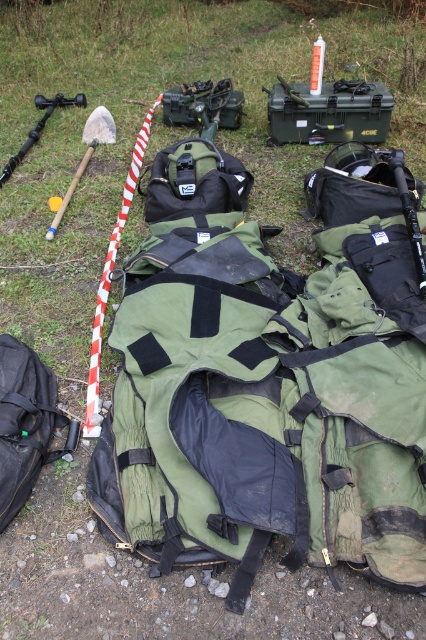
Which is in front, point (55, 28) or point (181, 180)?

Point (181, 180) is in front.

Does green matte backpack at center have a lesser height compared to matte black backpack at center?

Yes, green matte backpack at center is shorter than matte black backpack at center.

Find the location of a particular element. green matte backpack at center is located at coordinates (143, 120).

Find the location of a particular element. The width and height of the screenshot is (426, 640). green matte backpack at center is located at coordinates (143, 120).

Can you confirm if matte black backpack at center is thinner than wooden shovel at left?

No, matte black backpack at center is not thinner than wooden shovel at left.

Between point (187, 179) and point (52, 234), which one is positioned in front?

Point (52, 234) is in front.

Is point (178, 141) more distant than point (92, 122)?

That is False.

You are a GUI agent. You are given a task and a screenshot of the screen. Output one action in this format:
    pyautogui.click(x=<x>, y=<y>)
    Task: Click on the matte black backpack at center
    Image resolution: width=426 pixels, height=640 pixels.
    Given the screenshot: What is the action you would take?
    pyautogui.click(x=195, y=182)

Which is more to the left, black matte backpack at lower left or wooden shovel at left?

Positioned to the left is wooden shovel at left.

Can you confirm if black matte backpack at lower left is smaller than wooden shovel at left?

Correct, black matte backpack at lower left occupies less space than wooden shovel at left.

Locate an element on the screen. This screenshot has width=426, height=640. black matte backpack at lower left is located at coordinates (25, 422).

This screenshot has width=426, height=640. Find the location of `black matte backpack at lower left`. black matte backpack at lower left is located at coordinates (25, 422).